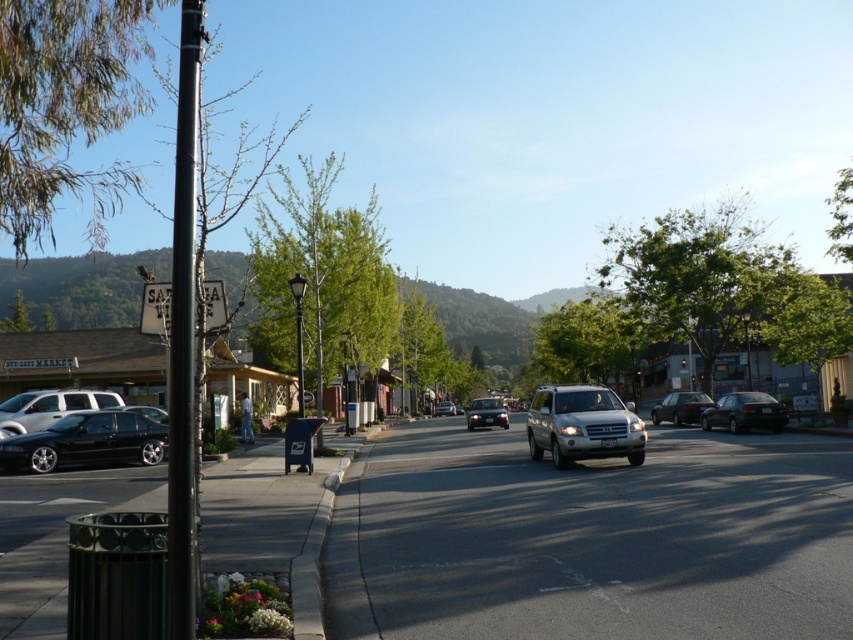
You are a delivery driver who needs to park your shiny silver sedan at center in a parking spot that can only accommodate vehicles up to the size of the matte silver sedan at center. Can your vehicle fit in the spot?

The shiny silver sedan at center has a larger size compared to the matte silver sedan at center, so it cannot fit in the parking spot designated for the smaller vehicle.

You are a delivery driver who needs to park your truck between the shiny black sedan at lower left and the matte silver sedan at center. Your truck is 20 feet long. Is there enough space between them to park?

The shiny black sedan at lower left and the matte silver sedan at center are 183.34 feet apart. Since your truck is only 20 feet long, there is more than enough space to park between them.

You are a delivery driver who needs to park a delivery van that is 20 feet long. You see the shiny silver sedan at center and the matte silver sedan at center. Is there enough space between them to park your van?

The shiny silver sedan at center and the matte silver sedan at center are 97.46 feet apart from each other, so yes, the delivery van can park between them since the space is wider than the van.